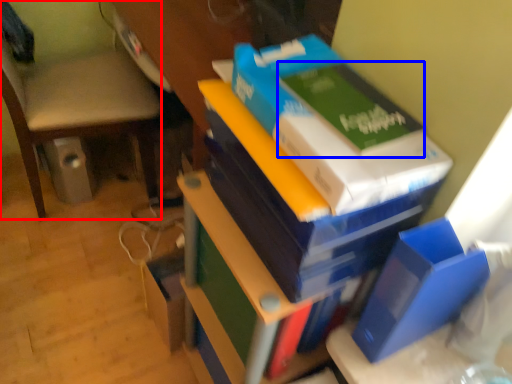
Question: Which object appears closest to the camera in this image, chair (highlighted by a red box) or paperback book (highlighted by a blue box)?

Choices:
 (A) chair
 (B) paperback book

Answer: (B)